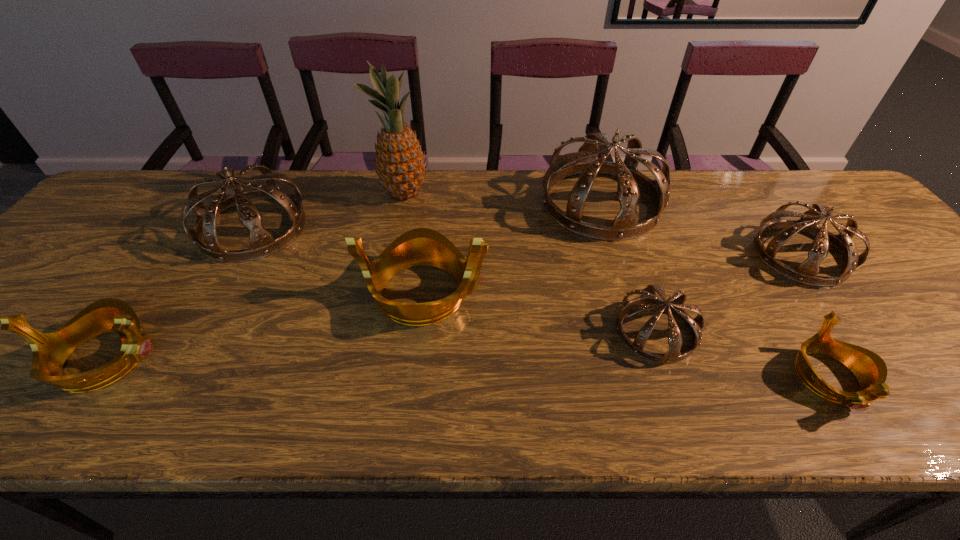
Select which gold tiara appears as the closest to the second gold tiara from left to right. Please provide its 2D coordinates. Your answer should be formatted as a tuple, i.e. [(x, y)], where the tuple contains the x and y coordinates of a point satisfying the conditions above.

[(50, 350)]